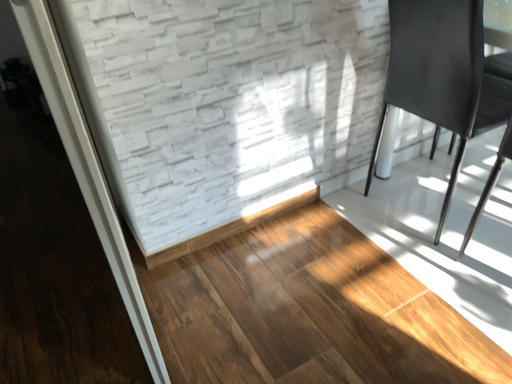
Question: Is brown wood flooring at center in front of matte black chair at right?

Choices:
 (A) yes
 (B) no

Answer: (A)

Question: Can you confirm if brown wood flooring at center is taller than matte black chair at right?

Choices:
 (A) yes
 (B) no

Answer: (B)

Question: Does brown wood flooring at center have a smaller size compared to matte black chair at right?

Choices:
 (A) no
 (B) yes

Answer: (B)

Question: From a real-world perspective, is brown wood flooring at center located higher than matte black chair at right?

Choices:
 (A) no
 (B) yes

Answer: (A)

Question: Is brown wood flooring at center further to camera compared to matte black chair at right?

Choices:
 (A) yes
 (B) no

Answer: (B)

Question: From a real-world perspective, is brown wood flooring at center located beneath matte black chair at right?

Choices:
 (A) no
 (B) yes

Answer: (B)

Question: Can you confirm if matte black chair at right is taller than brown wood flooring at center?

Choices:
 (A) yes
 (B) no

Answer: (A)

Question: Would you say matte black chair at right is a long distance from brown wood flooring at center?

Choices:
 (A) yes
 (B) no

Answer: (B)

Question: Is matte black chair at right facing towards brown wood flooring at center?

Choices:
 (A) no
 (B) yes

Answer: (A)

Question: Can you confirm if matte black chair at right is wider than brown wood flooring at center?

Choices:
 (A) yes
 (B) no

Answer: (B)

Question: Is brown wood flooring at center located within matte black chair at right?

Choices:
 (A) yes
 (B) no

Answer: (B)

Question: From a real-world perspective, is matte black chair at right located beneath brown wood flooring at center?

Choices:
 (A) no
 (B) yes

Answer: (A)

Question: From a real-world perspective, is brown wood flooring at center above or below matte black chair at right?

Choices:
 (A) below
 (B) above

Answer: (A)